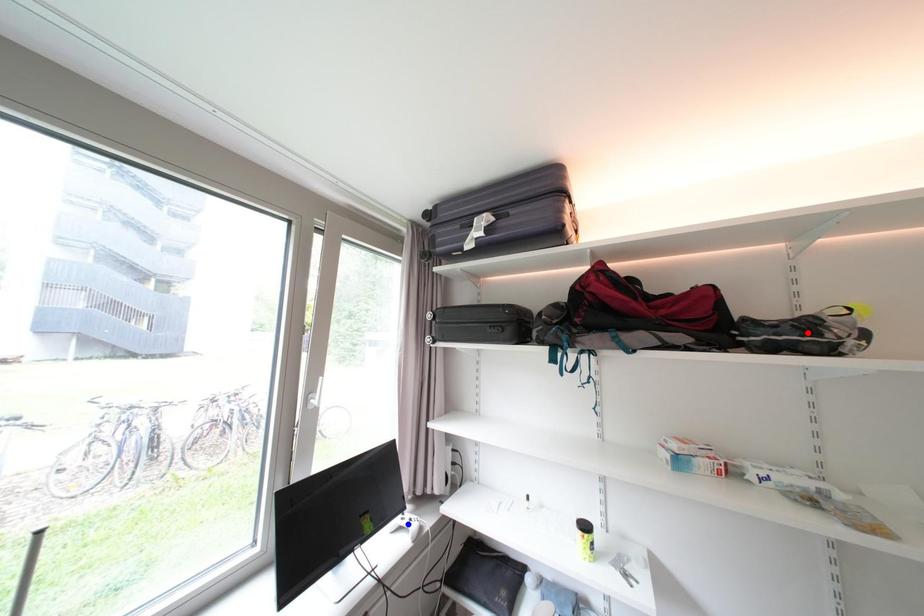
Question: Which of the two points in the image is closer to the camera?

Choices:
 (A) Blue point is closer.
 (B) Red point is closer.

Answer: (B)